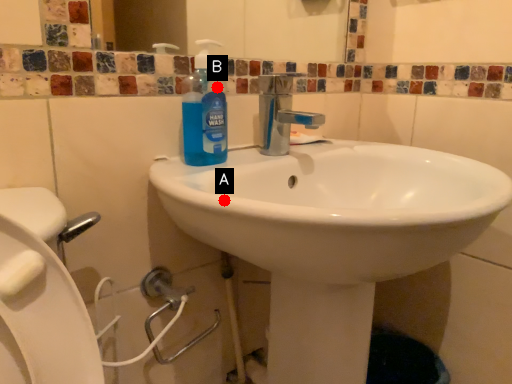
Question: Two points are circled on the image, labeled by A and B beside each circle. Which point is closer to the camera taking this photo?

Choices:
 (A) A is closer
 (B) B is closer

Answer: (A)